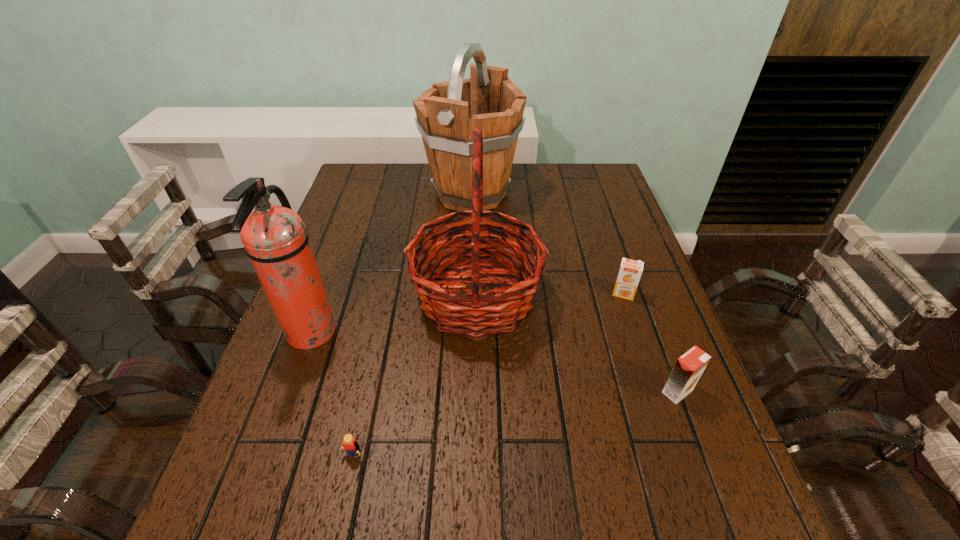
Identify the location of bucket. The height and width of the screenshot is (540, 960). (447, 114).

The height and width of the screenshot is (540, 960). I want to click on basket, so click(x=473, y=315).

At what (x,y) coordinates should I click in order to perform the action: click on fire extinguisher. Please return your answer as a coordinate pair (x, y). This screenshot has height=540, width=960. Looking at the image, I should click on click(274, 237).

Locate an element on the screen. the second nearest object is located at coordinates (689, 367).

In order to click on the farther orange juice in this screenshot , I will do `click(630, 271)`.

Locate an element on the screen. This screenshot has width=960, height=540. Lego is located at coordinates (349, 444).

Locate an element on the screen. The width and height of the screenshot is (960, 540). the nearest object is located at coordinates (349, 444).

Locate an element on the screen. Image resolution: width=960 pixels, height=540 pixels. vacant space located on the right of the farthest object is located at coordinates [x=577, y=194].

You are a GUI agent. You are given a task and a screenshot of the screen. Output one action in this format:
    pyautogui.click(x=<x>, y=<y>)
    Task: Click on the vacant point located on the front of the basket
    Image resolution: width=960 pixels, height=540 pixels.
    Given the screenshot: What is the action you would take?
    pyautogui.click(x=475, y=400)

Find the location of a particular element. The height and width of the screenshot is (540, 960). vacant space situated 0.070m at the nozzle of the leftmost object is located at coordinates (365, 333).